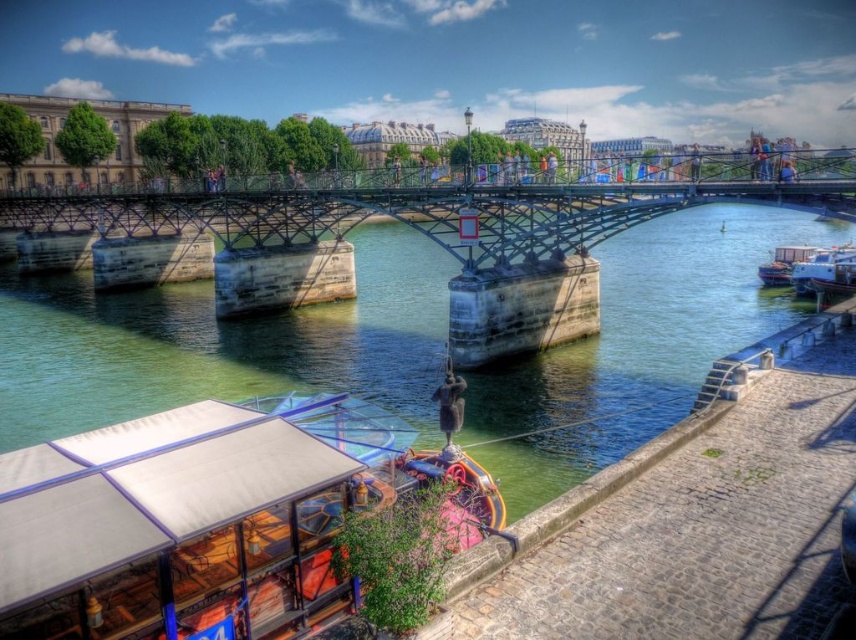
Question: Can you confirm if white wooden boat at right is positioned to the left of white glossy boat at right?

Choices:
 (A) yes
 (B) no

Answer: (A)

Question: Among these objects, which one is nearest to the camera?

Choices:
 (A) wooden boat at lower left
 (B) white wooden boat at right

Answer: (A)

Question: Which is farther from the green water at bridge center?

Choices:
 (A) white wooden boat at right
 (B) white glossy boat at right
 (C) wooden boat at lower left

Answer: (B)

Question: Which point is farther to the camera?

Choices:
 (A) pos(496,372)
 (B) pos(286,576)
 (C) pos(782,248)

Answer: (C)

Question: Can you confirm if green water at bridge center is wider than white wooden boat at right?

Choices:
 (A) no
 (B) yes

Answer: (B)

Question: From the image, what is the correct spatial relationship of wooden boat at lower left in relation to white wooden boat at right?

Choices:
 (A) below
 (B) above

Answer: (A)